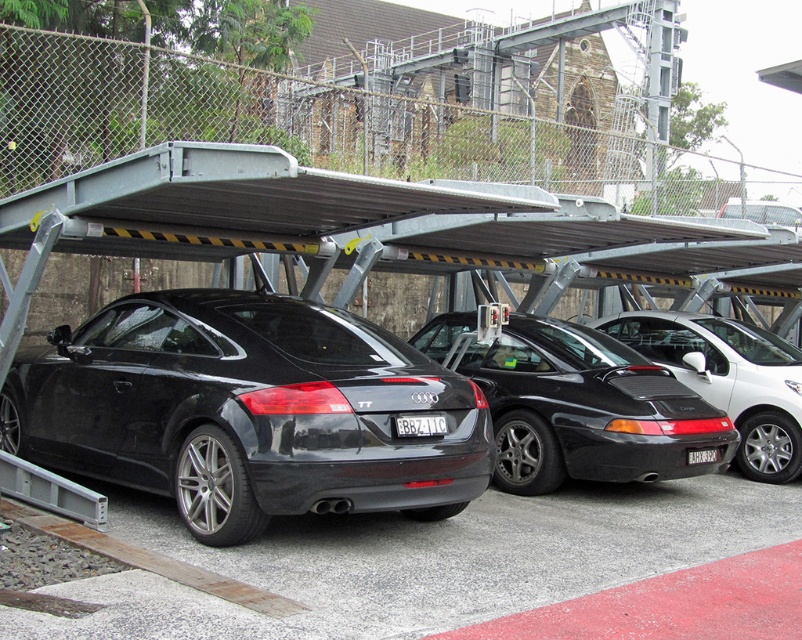
You are standing at the entrance of the parking area and want to take a photo of the glossy black car at center. If your camera has a maximum focus range of 5 meters, will you be able to capture it clearly?

The glossy black car at center is 4.73 meters away from the camera, which is within the maximum focus range of 5 meters. Therefore, you can capture it clearly.

You are a parking attendant and need to verify the license plate of the black matte sports car at center. Can you reach the black plastic license plate at center without moving the car?

The black matte sports car at center is bigger than the black plastic license plate at center, but the size difference does not necessarily indicate the license plate is out of reach. However, since the license plate is typically located at the rear of the car and easily visible from the ground level, you can likely reach it without moving the car.

You are a delivery person trying to park your van in the parking area. You see the glossy black car at center and the black matte car at center. Which car takes up more space in the parking spot?

The glossy black car at center takes up more space in the parking spot because it has a larger size compared to the black matte car at center.